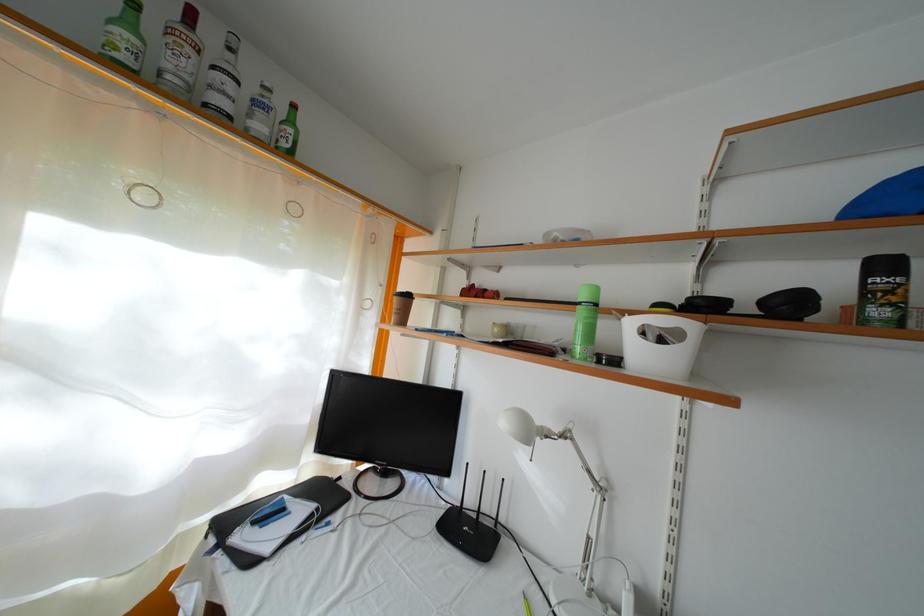
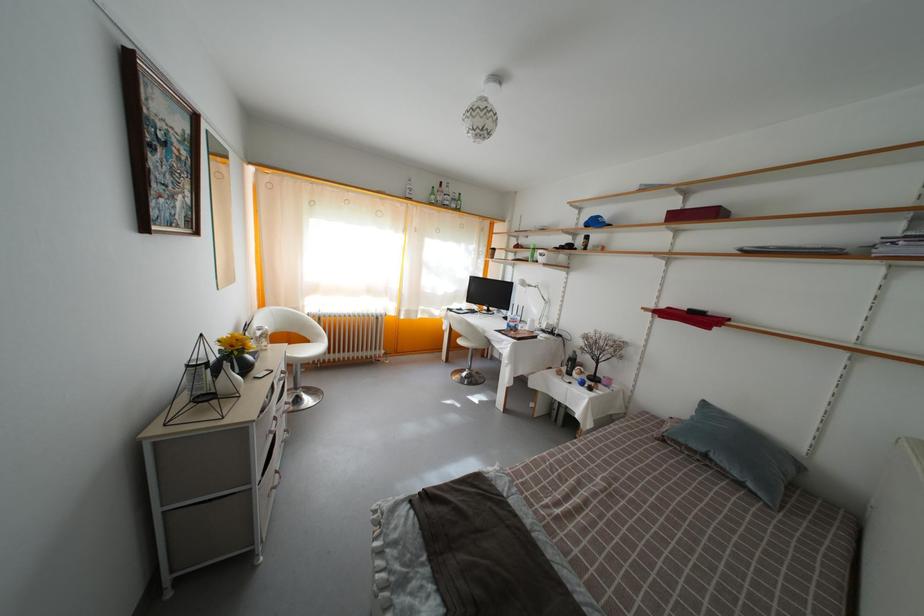
Where in the second image is the point corresponding to (711,220) from the first image?

(584, 225)